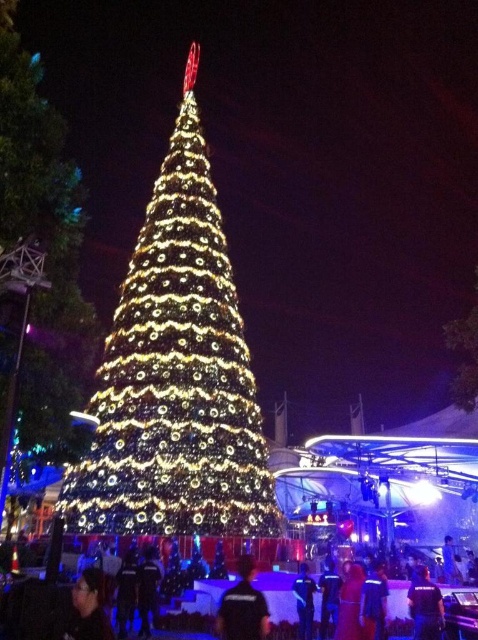
Which is above, illuminated green pine at center or black matte glasses at lower left?

Positioned higher is illuminated green pine at center.

Is point (165, 481) behind point (80, 598)?

Yes, point (165, 481) is behind point (80, 598).

Image resolution: width=478 pixels, height=640 pixels. What do you see at coordinates (175, 372) in the screenshot?
I see `illuminated green pine at center` at bounding box center [175, 372].

This screenshot has height=640, width=478. Identify the location of illuminated green pine at center. pyautogui.click(x=175, y=372).

Between black shirt at lower center and black matte glasses at lower left, which one has less height?

black matte glasses at lower left

Which is in front, point (231, 637) or point (72, 625)?

Positioned in front is point (72, 625).

Find the location of `black shirt at lower center`. black shirt at lower center is located at coordinates (242, 605).

Does illuminated green pine at center have a greater width compared to black shirt at lower center?

Yes.

Between point (177, 355) and point (263, 625), which one is positioned in front?

Point (263, 625)

Locate an element on the screen. The width and height of the screenshot is (478, 640). illuminated green pine at center is located at coordinates (175, 372).